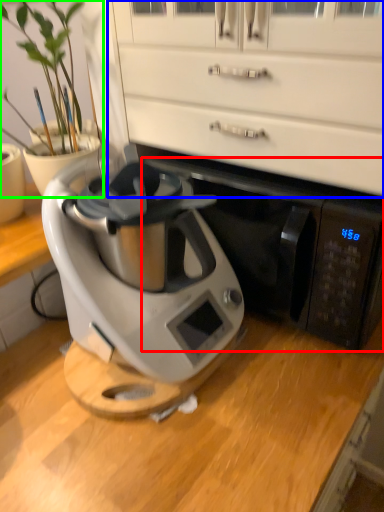
Question: Which is farther away from wide (highlighted by a red box)? dresser (highlighted by a blue box) or houseplant (highlighted by a green box)?

Choices:
 (A) dresser
 (B) houseplant

Answer: (B)